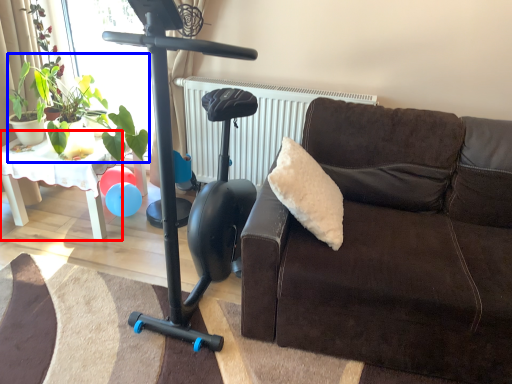
Question: Which point is further to the camera, table (highlighted by a red box) or plant (highlighted by a blue box)?

Choices:
 (A) table
 (B) plant

Answer: (A)